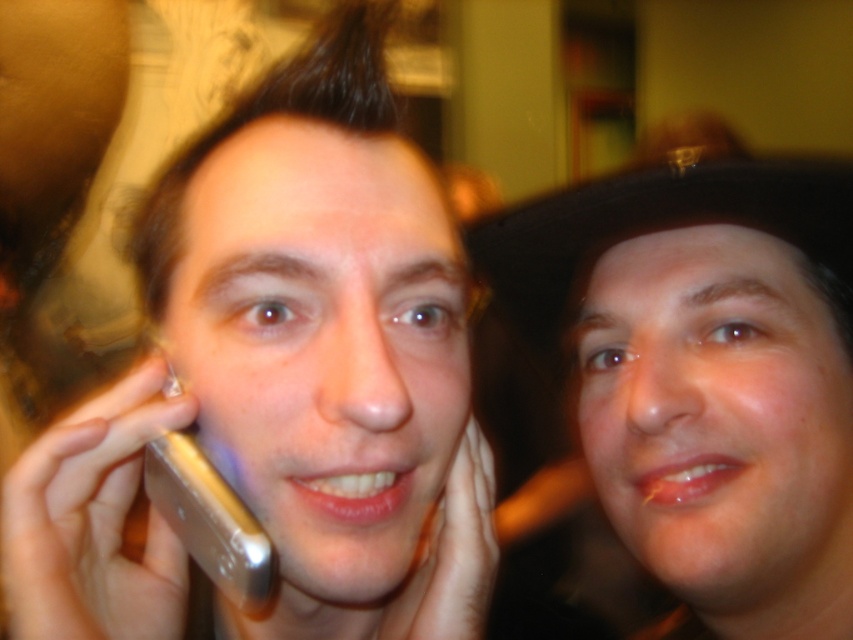
Question: Which of the following is the farthest from the observer?

Choices:
 (A) silver metallic phone at left
 (B) matte black hat at upper right

Answer: (B)

Question: Which point is closer to the camera?

Choices:
 (A) matte black hat at upper right
 (B) silver metallic phone at left

Answer: (B)

Question: Is silver metallic phone at left wider than matte black hat at upper right?

Choices:
 (A) yes
 (B) no

Answer: (B)

Question: Which point is farther from the camera taking this photo?

Choices:
 (A) (830, 426)
 (B) (335, 177)

Answer: (A)

Question: Can you confirm if silver metallic phone at left is positioned above matte black hat at upper right?

Choices:
 (A) no
 (B) yes

Answer: (B)

Question: Can you confirm if silver metallic phone at left is thinner than matte black hat at upper right?

Choices:
 (A) yes
 (B) no

Answer: (A)